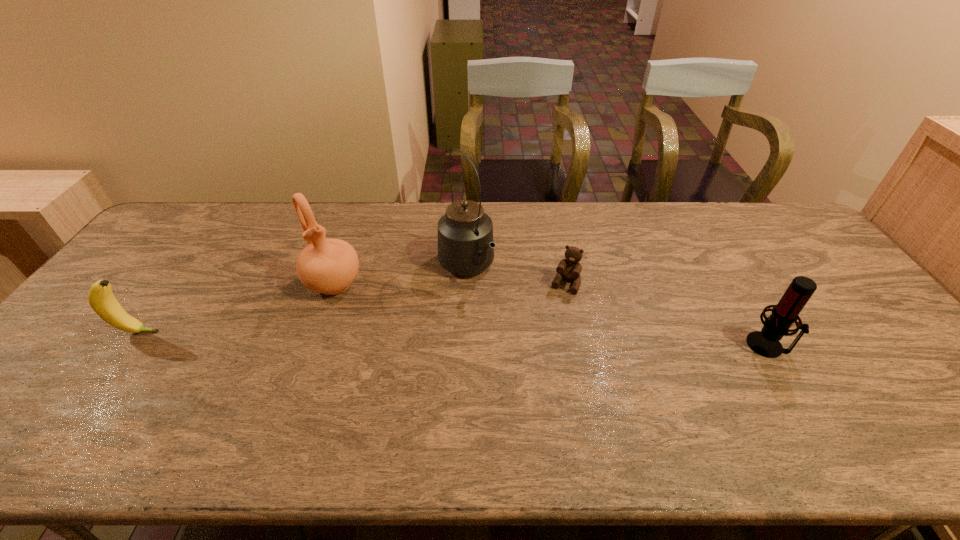
The height and width of the screenshot is (540, 960). Identify the location of vacant space located spout on the tallest object. (553, 374).

This screenshot has height=540, width=960. Identify the location of object that is positioned at the left edge. (100, 297).

At what (x,y) coordinates should I click in order to perform the action: click on blank area at the far edge. Please return your answer as a coordinate pair (x, y). The height and width of the screenshot is (540, 960). Looking at the image, I should click on (501, 211).

Image resolution: width=960 pixels, height=540 pixels. I want to click on free region at the near edge of the desktop, so click(234, 392).

You are a GUI agent. You are given a task and a screenshot of the screen. Output one action in this format:
    pyautogui.click(x=<x>, y=<y>)
    Task: Click on the blank area at the left edge
    
    Given the screenshot: What is the action you would take?
    pyautogui.click(x=91, y=341)

At what (x,y) coordinates should I click in order to perform the action: click on vacant space at the right edge of the desktop. Please return your answer as a coordinate pair (x, y). The height and width of the screenshot is (540, 960). Looking at the image, I should click on (792, 273).

You are a GUI agent. You are given a task and a screenshot of the screen. Output one action in this format:
    pyautogui.click(x=<x>, y=<y>)
    Task: Click on the free space at the near left corner of the desktop
    The height and width of the screenshot is (540, 960).
    Given the screenshot: What is the action you would take?
    pyautogui.click(x=16, y=403)

Identify the location of unoccupied position between the rightmost object and the second tallest object. This screenshot has height=540, width=960. (550, 314).

Where is `free space between the teddy bear and the fourth shortest object`? This screenshot has height=540, width=960. free space between the teddy bear and the fourth shortest object is located at coordinates click(x=449, y=284).

You are a GUI agent. You are given a task and a screenshot of the screen. Output one action in this format:
    pyautogui.click(x=<x>, y=<y>)
    Task: Click on the free point between the kettle and the shortest object
    
    Given the screenshot: What is the action you would take?
    pyautogui.click(x=516, y=276)